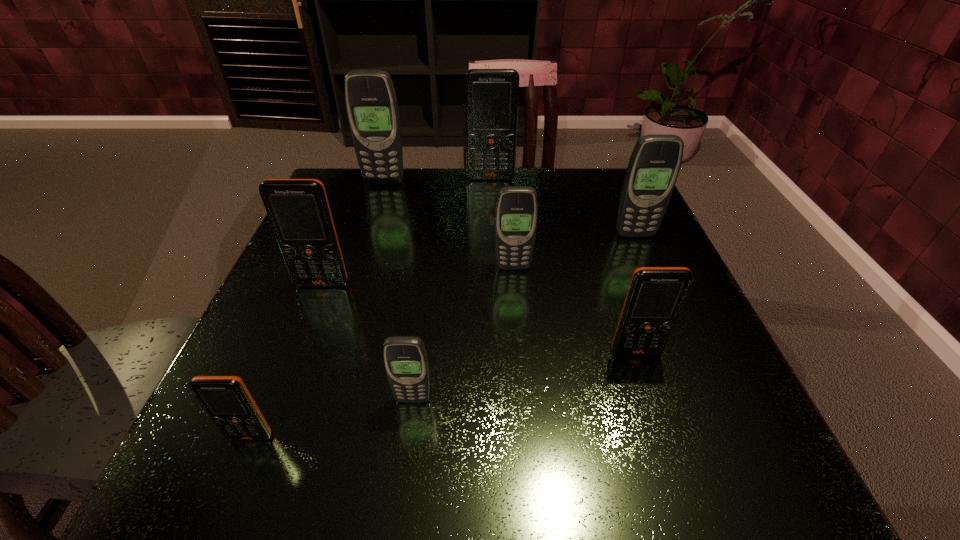
This screenshot has height=540, width=960. In order to click on free space between the fourth nearest object and the fourth farthest cellular telephone in this screenshot , I will do `click(418, 276)`.

Locate an element on the screen. The image size is (960, 540). object that is the seventh closest to the farthest orange cellular telephone is located at coordinates (226, 399).

Locate which object is the third closest to the second biggest orange cellular telephone. Please provide its 2D coordinates. Your answer should be formatted as a tuple, i.e. [(x, y)], where the tuple contains the x and y coordinates of a point satisfying the conditions above.

[(226, 399)]

Identify which cellular telephone is the second nearest to the second orange cellular telephone from right to left. Please provide its 2D coordinates. Your answer should be formatted as a tuple, i.e. [(x, y)], where the tuple contains the x and y coordinates of a point satisfying the conditions above.

[(654, 165)]

Select which cellular telephone appears as the sixth closest to the third farthest object. Please provide its 2D coordinates. Your answer should be formatted as a tuple, i.e. [(x, y)], where the tuple contains the x and y coordinates of a point satisfying the conditions above.

[(298, 209)]

Identify the location of orange cellular telephone object that ranks as the second closest to the fifth object from right to left. This screenshot has height=540, width=960. (298, 209).

Find the location of a particular element. orange cellular telephone that is the second closest to the second smallest orange cellular telephone is located at coordinates (226, 399).

Select which gray cellular telephone appears as the closest to the smallest gray cellular telephone. Please provide its 2D coordinates. Your answer should be formatted as a tuple, i.e. [(x, y)], where the tuple contains the x and y coordinates of a point satisfying the conditions above.

[(516, 214)]

Select which gray cellular telephone is the second closest to the leftmost gray cellular telephone. Please provide its 2D coordinates. Your answer should be formatted as a tuple, i.e. [(x, y)], where the tuple contains the x and y coordinates of a point satisfying the conditions above.

[(654, 165)]